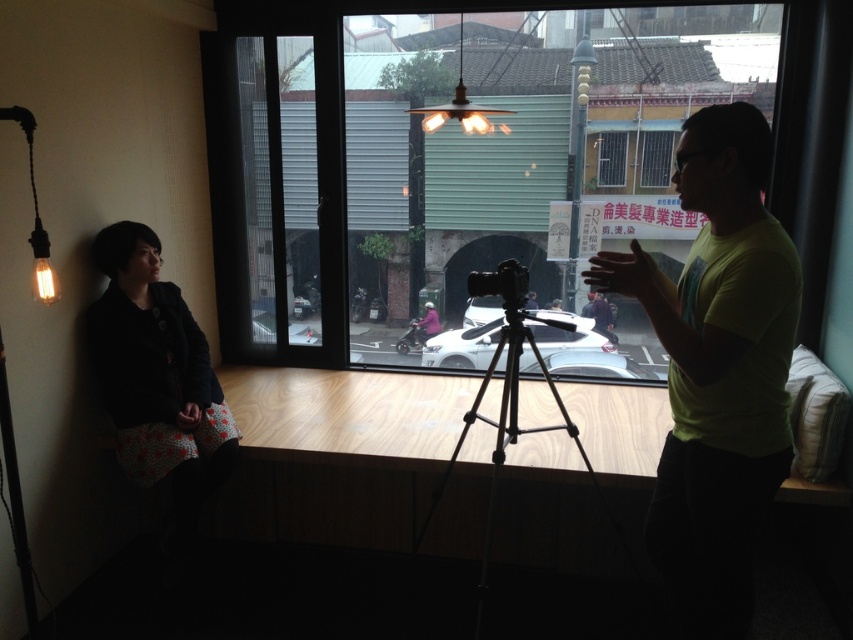
Which is behind, point (740, 360) or point (669, 138)?

The point (669, 138) is behind.

Can you confirm if yellow matte shirt at center is smaller than clear glass window at center?

Incorrect, yellow matte shirt at center is not smaller in size than clear glass window at center.

I want to click on yellow matte shirt at center, so click(x=717, y=369).

Which is more to the right, black fabric jacket at left or metallic grid at center?

metallic grid at center

Is black fabric jacket at left shorter than metallic grid at center?

In fact, black fabric jacket at left may be taller than metallic grid at center.

Is point (167, 378) farther from camera compared to point (613, 148)?

No.

Locate an element on the screen. black fabric jacket at left is located at coordinates (155, 369).

Can you confirm if black plastic camera at center is bigger than metallic grid at center?

No, black plastic camera at center is not bigger than metallic grid at center.

Does black plastic camera at center have a greater width compared to metallic grid at center?

Indeed, black plastic camera at center has a greater width compared to metallic grid at center.

Describe the element at coordinates (502, 284) in the screenshot. I see `black plastic camera at center` at that location.

This screenshot has width=853, height=640. In order to click on black plastic camera at center in this screenshot , I will do `click(502, 284)`.